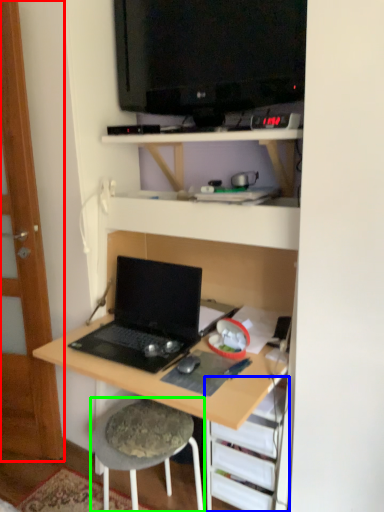
Question: Estimate the real-world distances between objects in this image. Which object is closer to glass door (highlighted by a red box), shelf (highlighted by a blue box) or stool (highlighted by a green box)?

Choices:
 (A) shelf
 (B) stool

Answer: (B)